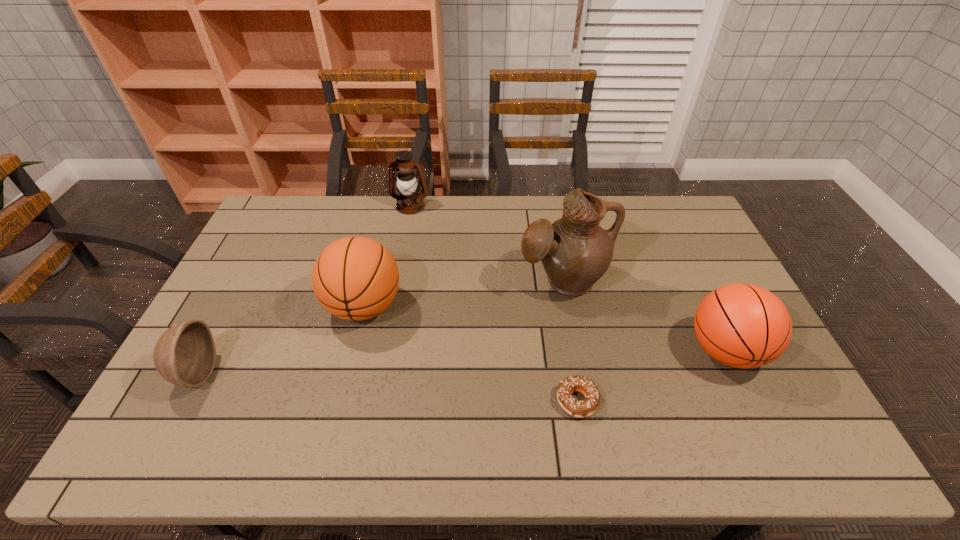
Identify which object is located as the third nearest to the left basketball. Please provide its 2D coordinates. Your answer should be formatted as a tuple, i.e. [(x, y)], where the tuple contains the x and y coordinates of a point satisfying the conditions above.

[(575, 251)]

Point out which object is positioned as the fourth nearest to the fifth tallest object. Please provide its 2D coordinates. Your answer should be formatted as a tuple, i.e. [(x, y)], where the tuple contains the x and y coordinates of a point satisfying the conditions above.

[(583, 408)]

This screenshot has width=960, height=540. I want to click on free region that satisfies the following two spatial constraints: 1. on the back side of the fifth tallest object; 2. on the left side of the left basketball, so click(x=231, y=306).

This screenshot has width=960, height=540. I want to click on free region that satisfies the following two spatial constraints: 1. on the side of the shortest object, there is a wick adjustment knob; 2. on the right side of the lantern, so click(373, 401).

The height and width of the screenshot is (540, 960). What are the coordinates of `vacant point that satisfies the following two spatial constraints: 1. on the side of the farthest object, there is a wick adjustment knob; 2. on the right side of the shortest object` in the screenshot? It's located at (373, 401).